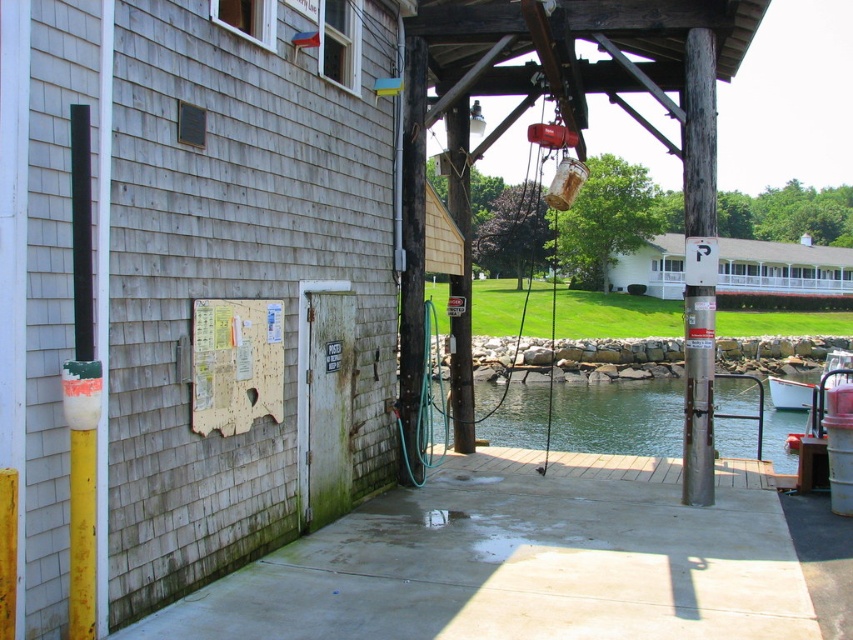
Question: Does concrete at center appear on the right side of white plastic boat at lower right?

Choices:
 (A) no
 (B) yes

Answer: (A)

Question: Is concrete at center wider than green water at dock center?

Choices:
 (A) yes
 (B) no

Answer: (B)

Question: Can you confirm if green water at dock center is positioned above wooden post at right?

Choices:
 (A) yes
 (B) no

Answer: (B)

Question: Which point appears closest to the camera in this image?

Choices:
 (A) (770, 291)
 (B) (773, 428)
 (C) (688, 426)

Answer: (C)

Question: Which object is positioned closest to the concrete at center?

Choices:
 (A) white wooden porch at upper center
 (B) wooden post at right
 (C) green water at dock center
 (D) white plastic boat at lower right

Answer: (B)

Question: Considering the real-world distances, which object is closest to the wooden post at right?

Choices:
 (A) concrete at center
 (B) green water at dock center

Answer: (A)